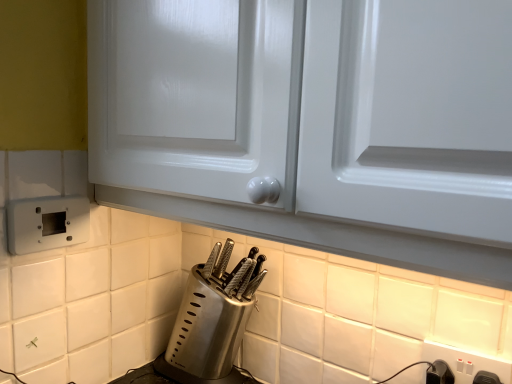
Question: Looking at the image, does white plastic electric outlet at lower left, which appears as the first electric outlet when viewed from the left, seem bigger or smaller compared to black plastic switch at lower right?

Choices:
 (A) big
 (B) small

Answer: (A)

Question: Based on their positions, is white plastic electric outlet at lower left, the 1th electric outlet when ordered from top to bottom, located to the left or right of black plastic switch at lower right?

Choices:
 (A) left
 (B) right

Answer: (A)

Question: Considering the real-world distances, which object is farthest from the satin silver knife block at lower center?

Choices:
 (A) white plastic electric outlet at lower left, the second electric outlet in the right-to-left sequence
 (B) white plastic electric outlet at lower right, which ranks as the second electric outlet in top-to-bottom order
 (C) black plastic switch at lower right

Answer: (C)

Question: Considering the real-world distances, which object is closest to the black plastic switch at lower right?

Choices:
 (A) white plastic electric outlet at lower right, the first electric outlet ordered from the bottom
 (B) satin silver knife block at lower center
 (C) white plastic electric outlet at lower left, the second electric outlet when ordered from bottom to top

Answer: (A)